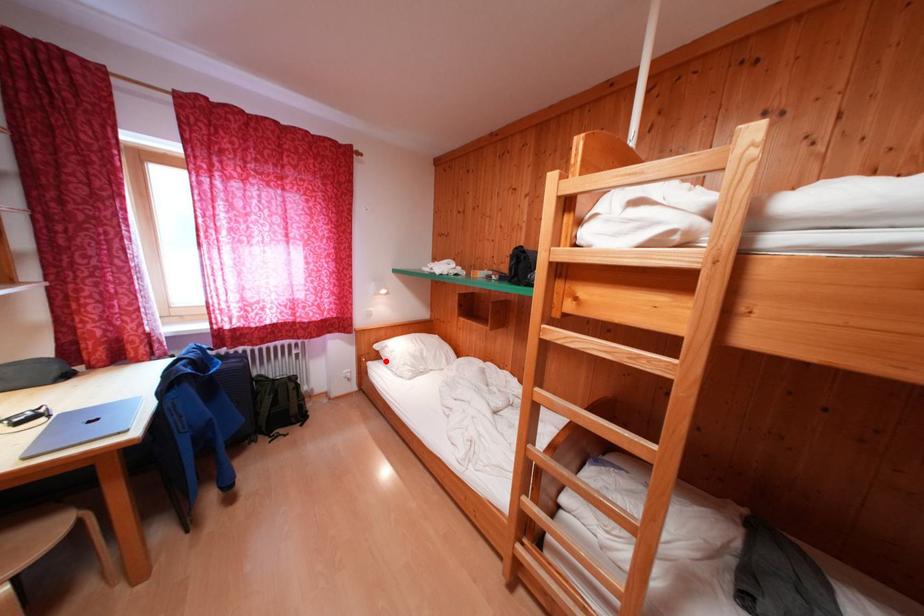
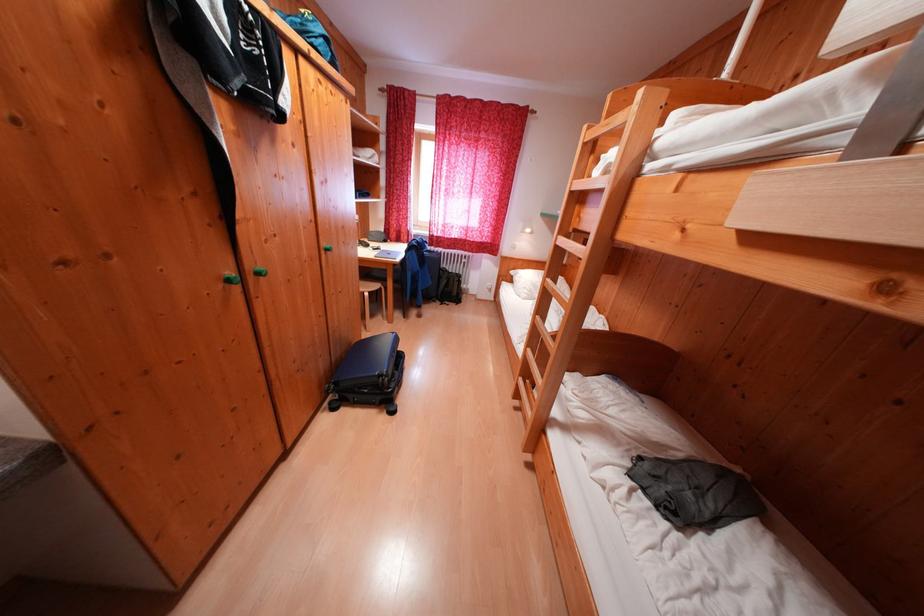
Find the pixel in the second image that matches the highlighted location in the first image.

(518, 284)